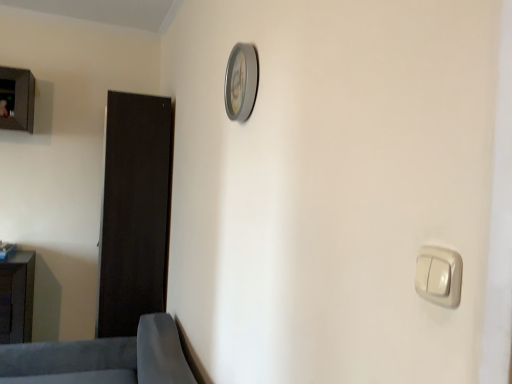
Question: Is silver metallic clock at upper center positioned beyond the bounds of dark wood door at left?

Choices:
 (A) no
 (B) yes

Answer: (B)

Question: Does silver metallic clock at upper center have a lesser width compared to dark wood door at left?

Choices:
 (A) no
 (B) yes

Answer: (B)

Question: Could you tell me if silver metallic clock at upper center is facing dark wood door at left?

Choices:
 (A) no
 (B) yes

Answer: (A)

Question: From the image's perspective, is silver metallic clock at upper center under dark wood door at left?

Choices:
 (A) no
 (B) yes

Answer: (A)

Question: Does silver metallic clock at upper center have a larger size compared to dark wood door at left?

Choices:
 (A) no
 (B) yes

Answer: (A)

Question: From the image's perspective, is dark wood door at left positioned above or below white glossy light switch at lower right?

Choices:
 (A) above
 (B) below

Answer: (B)

Question: Is dark wood door at left taller or shorter than white glossy light switch at lower right?

Choices:
 (A) short
 (B) tall

Answer: (B)

Question: Visually, is dark wood door at left positioned to the left or to the right of white glossy light switch at lower right?

Choices:
 (A) right
 (B) left

Answer: (B)

Question: Considering the positions of point (138, 316) and point (449, 294), is point (138, 316) closer or farther from the camera than point (449, 294)?

Choices:
 (A) closer
 (B) farther

Answer: (B)

Question: Considering the positions of soft gray fabric sofa at lower left, which ranks as the 1th furniture in front-to-back order, and dark wood door at left in the image, is soft gray fabric sofa at lower left, which ranks as the 1th furniture in front-to-back order, wider or thinner than dark wood door at left?

Choices:
 (A) wide
 (B) thin

Answer: (A)

Question: From a real-world perspective, relative to dark wood door at left, is soft gray fabric sofa at lower left, which appears as the 2th furniture when viewed from the back, vertically above or below?

Choices:
 (A) below
 (B) above

Answer: (A)

Question: In the image, is soft gray fabric sofa at lower left, which ranks as the 1th furniture in front-to-back order, positioned in front of or behind dark wood door at left?

Choices:
 (A) front
 (B) behind

Answer: (A)

Question: Looking at the image, does soft gray fabric sofa at lower left, arranged as the second furniture when viewed from the left, seem bigger or smaller compared to dark wood door at left?

Choices:
 (A) big
 (B) small

Answer: (A)

Question: Is white glossy light switch at lower right wider or thinner than silver metallic clock at upper center?

Choices:
 (A) thin
 (B) wide

Answer: (A)

Question: Do you think white glossy light switch at lower right is within silver metallic clock at upper center, or outside of it?

Choices:
 (A) outside
 (B) inside

Answer: (A)